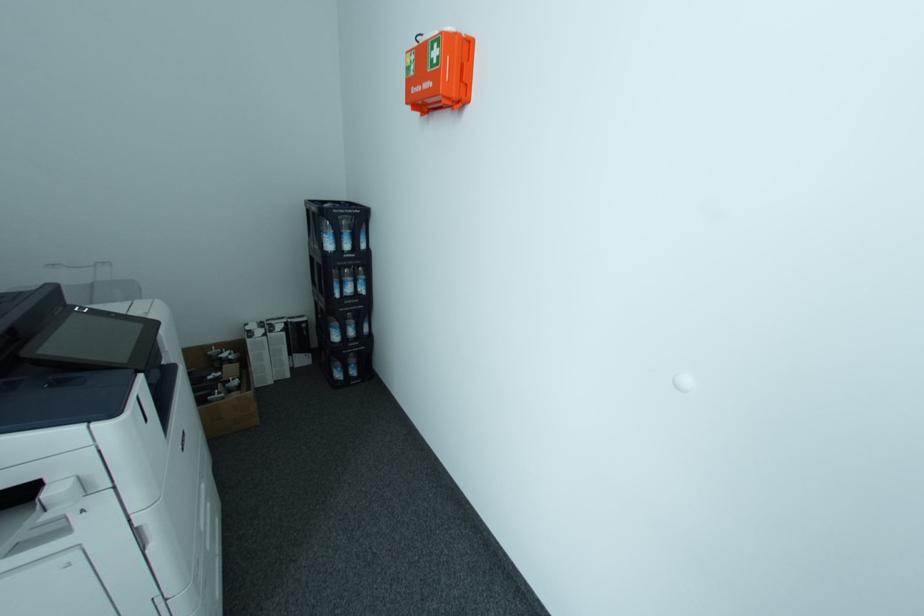
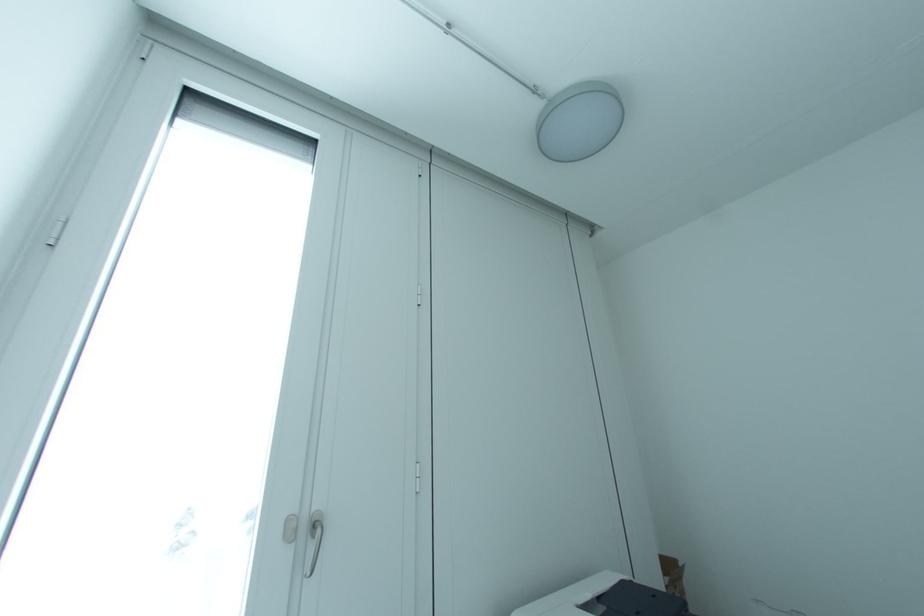
Based on the continuous images, in which direction is the camera rotating?

The camera's rotation is toward left-up.